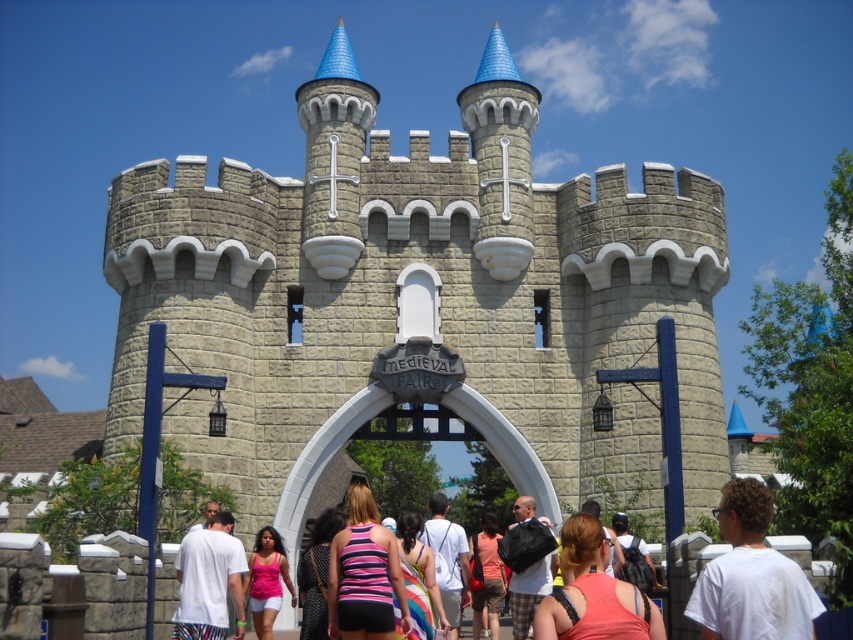
Which is more to the right, white matte t-shirt at center or striped fabric tank top at center?

white matte t-shirt at center is more to the right.

Is point (767, 566) farther from viewer compared to point (485, 582)?

No, (767, 566) is in front of (485, 582).

Is point (744, 595) farther from viewer compared to point (474, 634)?

That is False.

What are the coordinates of `white matte t-shirt at center` in the screenshot? It's located at (751, 577).

Is polka dot dress at center in front of matte black backpack at center?

Yes.

Locate an element on the screen. The image size is (853, 640). polka dot dress at center is located at coordinates (316, 573).

Who is more distant from viewer, (323,276) or (229,552)?

The point (323,276) is more distant.

What are the coordinates of `light gray stone castle at center` in the screenshot? It's located at (421, 301).

Locate an element on the screen. light gray stone castle at center is located at coordinates (421, 301).

Find the location of `light gray stone castle at center`. light gray stone castle at center is located at coordinates (421, 301).